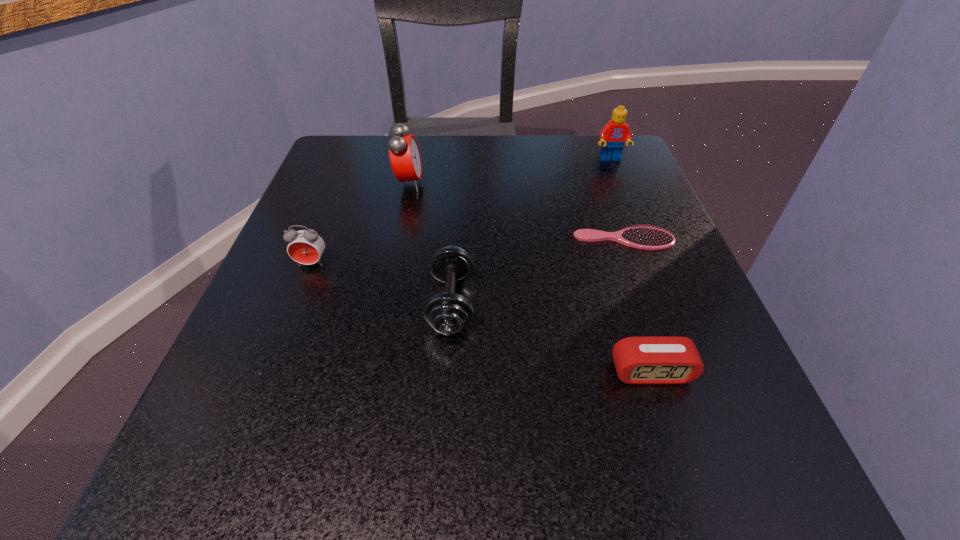
Locate which object ranks fourth in proximity to the hairbrush. Please provide its 2D coordinates. Your answer should be formatted as a tuple, i.e. [(x, y)], where the tuple contains the x and y coordinates of a point satisfying the conditions above.

[(405, 158)]

Locate an element on the screen. Image resolution: width=960 pixels, height=540 pixels. the second closest object to the hairbrush is located at coordinates (655, 359).

Locate an element on the screen. The height and width of the screenshot is (540, 960). the second closest alarm clock to the Lego is located at coordinates (655, 359).

Identify which alarm clock is the second nearest to the third object from left to right. Please provide its 2D coordinates. Your answer should be formatted as a tuple, i.e. [(x, y)], where the tuple contains the x and y coordinates of a point satisfying the conditions above.

[(655, 359)]

The image size is (960, 540). In order to click on free region that satisfies the following two spatial constraints: 1. on the front-facing side of the tallest alarm clock; 2. on the face of the leftmost alarm clock in this screenshot , I will do `click(393, 264)`.

I want to click on free space that satisfies the following two spatial constraints: 1. on the face of the farthest object; 2. on the front-facing side of the tallest alarm clock, so click(x=620, y=184).

What are the coordinates of `free spot that satisfies the following two spatial constraints: 1. on the back side of the shortest object; 2. on the left side of the third object from left to right` in the screenshot? It's located at (455, 240).

In order to click on free space that satisfies the following two spatial constraints: 1. on the front-facing side of the second farthest object; 2. on the face of the leftmost alarm clock in this screenshot , I will do `click(393, 264)`.

Where is `vacant area that satisfies the following two spatial constraints: 1. on the front-facing side of the farthest alarm clock; 2. on the back side of the dumbbell`? The image size is (960, 540). vacant area that satisfies the following two spatial constraints: 1. on the front-facing side of the farthest alarm clock; 2. on the back side of the dumbbell is located at coordinates (385, 303).

Where is `free spot that satisfies the following two spatial constraints: 1. on the face of the third tallest object; 2. on the right side of the fourth object from right to left`? free spot that satisfies the following two spatial constraints: 1. on the face of the third tallest object; 2. on the right side of the fourth object from right to left is located at coordinates (297, 303).